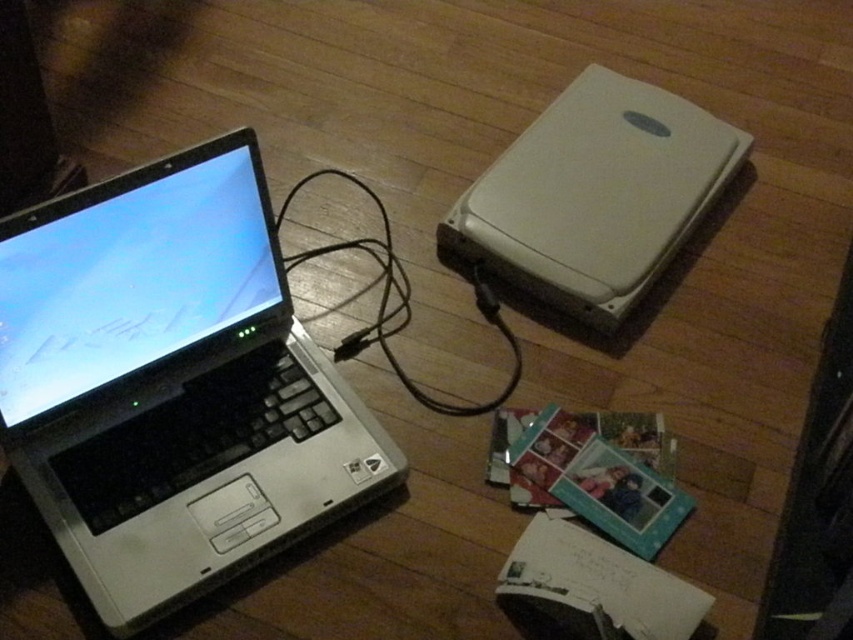
Locate an element on the screen. silver metallic laptop at left is located at coordinates (171, 385).

Who is more distant from viewer, (250,179) or (347,244)?

The point (347,244) is more distant.

Locate an element on the screen. silver metallic laptop at left is located at coordinates (171, 385).

Is silver metallic laptop at left positioned at the back of white plastic scanner at center?

No.

Who is positioned more to the right, silver metallic laptop at left or white plastic scanner at center?

Positioned to the right is white plastic scanner at center.

Is point (86, 458) farther from viewer compared to point (679, 232)?

No, it is not.

Find the location of a particular element. This screenshot has height=640, width=853. silver metallic laptop at left is located at coordinates (171, 385).

Between white plastic scanner at center and black cable at center, which one appears on the left side from the viewer's perspective?

black cable at center is more to the left.

Looking at this image, between white plastic scanner at center and black cable at center, which one appears on the right side from the viewer's perspective?

white plastic scanner at center

Between point (585, 147) and point (393, 358), which one is positioned in front?

Point (393, 358) is in front.

Find the location of a particular element. Image resolution: width=853 pixels, height=640 pixels. white plastic scanner at center is located at coordinates (595, 195).